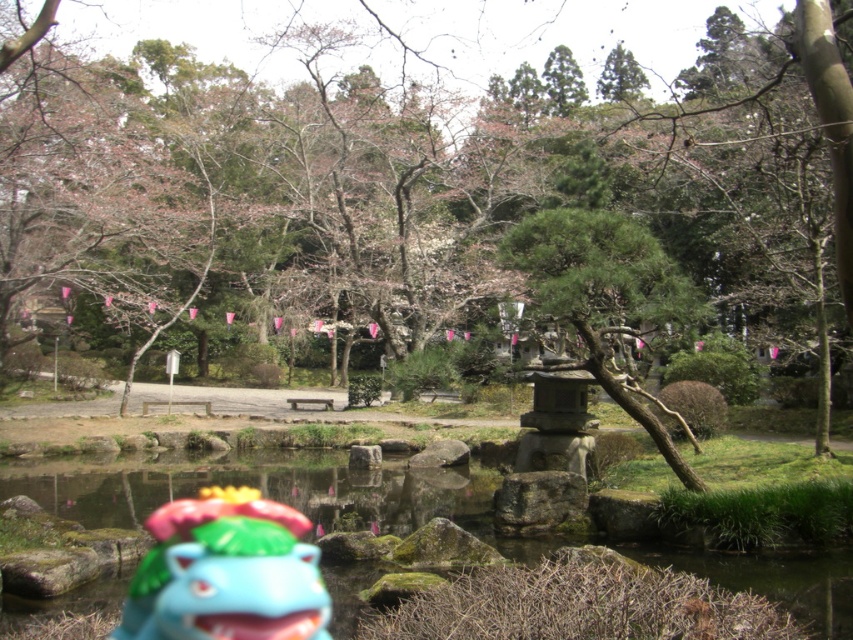
Between green mossy rocks at center and shiny plastic toy at lower center, which one has more height?

green mossy rocks at center

Describe the element at coordinates (437, 515) in the screenshot. I see `green mossy rocks at center` at that location.

Who is more distant from viewer, [64,509] or [143,612]?

Positioned behind is point [64,509].

At what (x,y) coordinates should I click in order to perform the action: click on green mossy rocks at center. Please return your answer as a coordinate pair (x, y). The height and width of the screenshot is (640, 853). Looking at the image, I should click on [x=437, y=515].